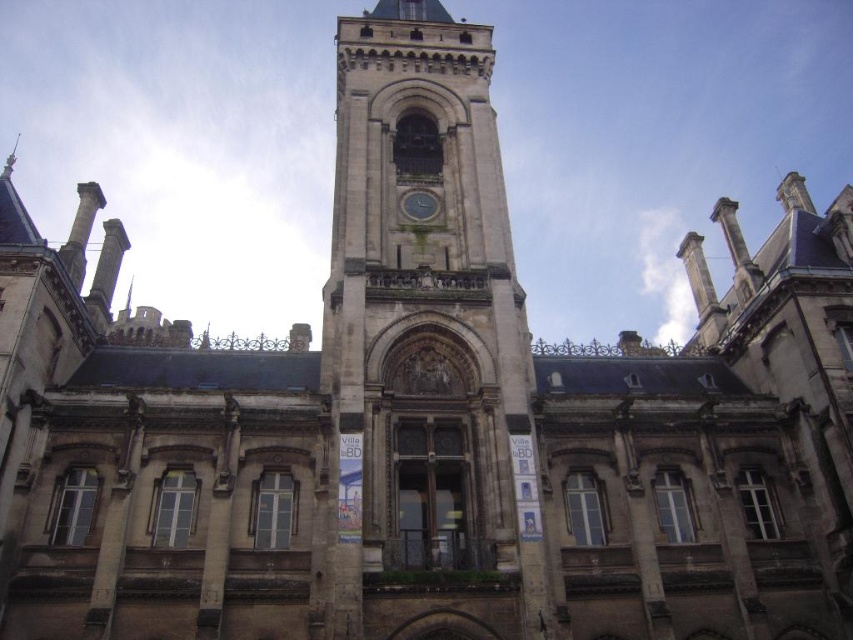
Question: Does brown stone clock tower at center have a smaller size compared to green glass clock at center?

Choices:
 (A) no
 (B) yes

Answer: (A)

Question: Which point is farther to the camera?

Choices:
 (A) (427, 202)
 (B) (413, 307)

Answer: (A)

Question: Which point is closer to the camera taking this photo?

Choices:
 (A) (416, 220)
 (B) (384, 356)

Answer: (B)

Question: Considering the relative positions of brown stone clock tower at center and green glass clock at center in the image provided, where is brown stone clock tower at center located with respect to green glass clock at center?

Choices:
 (A) left
 (B) right

Answer: (A)

Question: Can you confirm if brown stone clock tower at center is bigger than green glass clock at center?

Choices:
 (A) yes
 (B) no

Answer: (A)

Question: Which object is farther from the camera taking this photo?

Choices:
 (A) green glass clock at center
 (B) brown stone clock tower at center

Answer: (A)